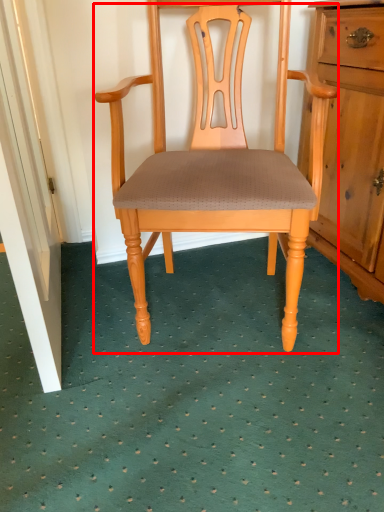
Question: From the image's perspective, where is chair (annotated by the red box) located in relation to door in the image?

Choices:
 (A) below
 (B) above

Answer: (A)